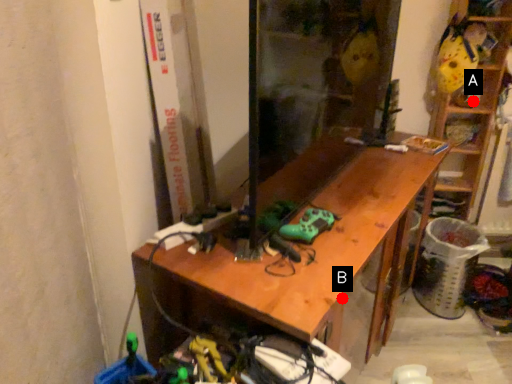
Question: Two points are circled on the image, labeled by A and B beside each circle. Among these points, which one is nearest to the camera?

Choices:
 (A) A is closer
 (B) B is closer

Answer: (B)